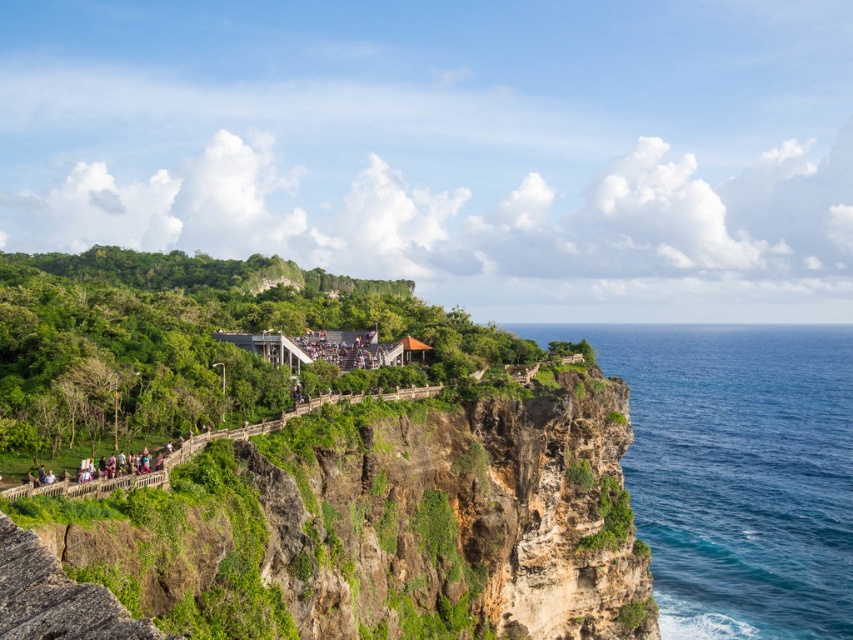
Question: Does green leafy hillside at center appear on the right side of blue smooth water at right?

Choices:
 (A) no
 (B) yes

Answer: (A)

Question: Does green leafy hillside at center come behind blue smooth water at right?

Choices:
 (A) no
 (B) yes

Answer: (A)

Question: Which point appears farthest from the camera in this image?

Choices:
 (A) (715, 595)
 (B) (281, 433)

Answer: (A)

Question: Is green leafy hillside at center further to the viewer compared to blue smooth water at right?

Choices:
 (A) yes
 (B) no

Answer: (B)

Question: Which object appears farthest from the camera in this image?

Choices:
 (A) green leafy hillside at center
 (B) blue smooth water at right

Answer: (B)